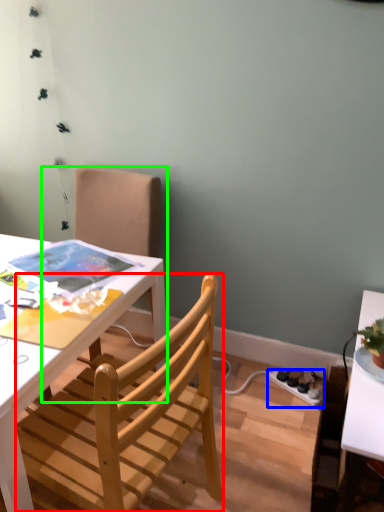
Question: Which object is the farthest from chair (highlighted by a red box)? Choose among these: power outlet (highlighted by a blue box) or chair (highlighted by a green box).

Choices:
 (A) power outlet
 (B) chair

Answer: (A)